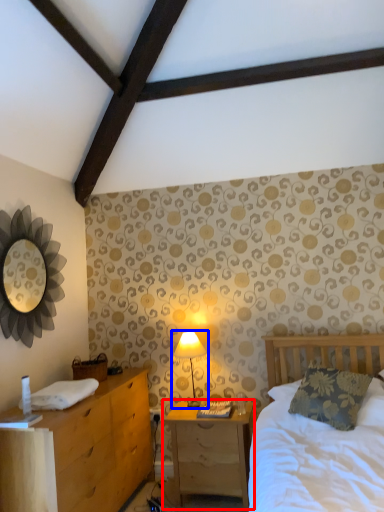
Question: Which object appears closest to the camera in this image, nightstand (highlighted by a red box) or table lamp (highlighted by a blue box)?

Choices:
 (A) nightstand
 (B) table lamp

Answer: (A)